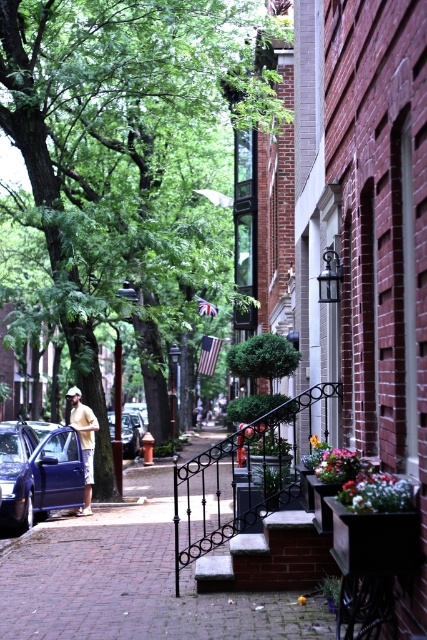
You are a photographer standing at the camera position. You want to take a photo that includes both point (0, 442) and point (88, 452). Which point will appear larger in the photo?

Point 0.692, 002 will appear larger in the photo because it is closer to the camera than point (88, 452).

You are a delivery person trying to park your 1.8 meter wide delivery van. You see the matte blue car at left and the light yellow shirt at center. Which parking spot can you fit into based on their widths?

The matte blue car at left is wider than the light yellow shirt at center, so the delivery van can fit into the parking spot where the matte blue car at left is parked since it is wider.